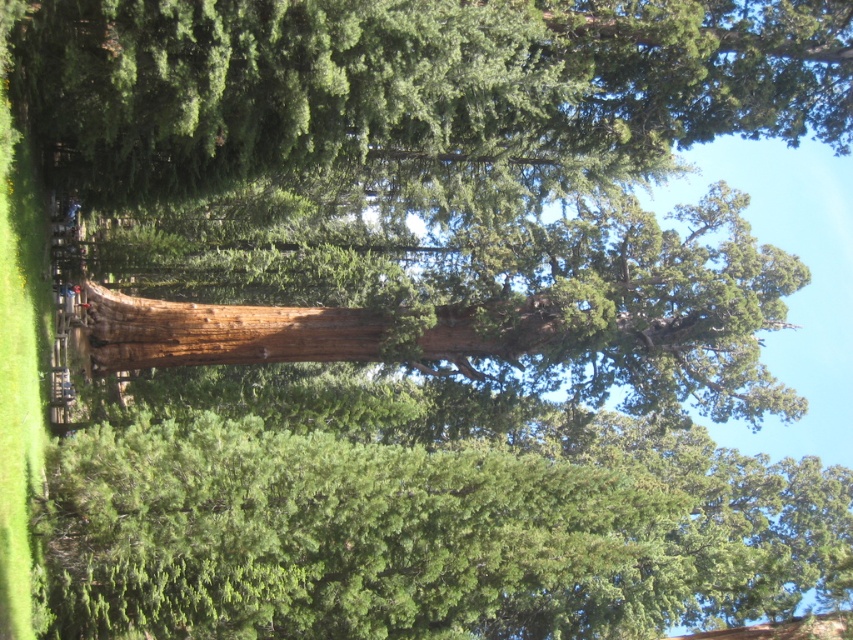
Does green rough bark tree at center have a lesser height compared to smooth brown tree trunk at center?

No.

Is green rough bark tree at center further to camera compared to smooth brown tree trunk at center?

No.

You are a GUI agent. You are given a task and a screenshot of the screen. Output one action in this format:
    pyautogui.click(x=<x>, y=<y>)
    Task: Click on the green rough bark tree at center
    
    Given the screenshot: What is the action you would take?
    pyautogui.click(x=430, y=528)

Who is taller, smooth brown tree trunk at center or brown rough log at center?

smooth brown tree trunk at center is taller.

Which is behind, point (718, 397) or point (512, 352)?

Point (718, 397)

This screenshot has width=853, height=640. Identify the location of smooth brown tree trunk at center. (485, 304).

Is green rough bark tree at center shorter than brown rough log at center?

No.

Describe the element at coordinates (430, 528) in the screenshot. The width and height of the screenshot is (853, 640). I see `green rough bark tree at center` at that location.

Find the location of `green rough bark tree at center`. green rough bark tree at center is located at coordinates (430, 528).